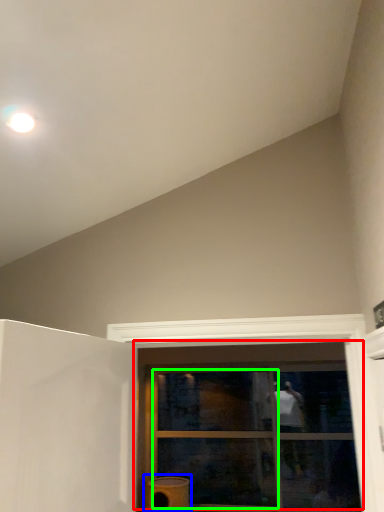
Question: Estimate the real-world distances between objects in this image. Which object is closer to window (highlighted by a red box), water heater (highlighted by a blue box) or glass door (highlighted by a green box)?

Choices:
 (A) water heater
 (B) glass door

Answer: (B)